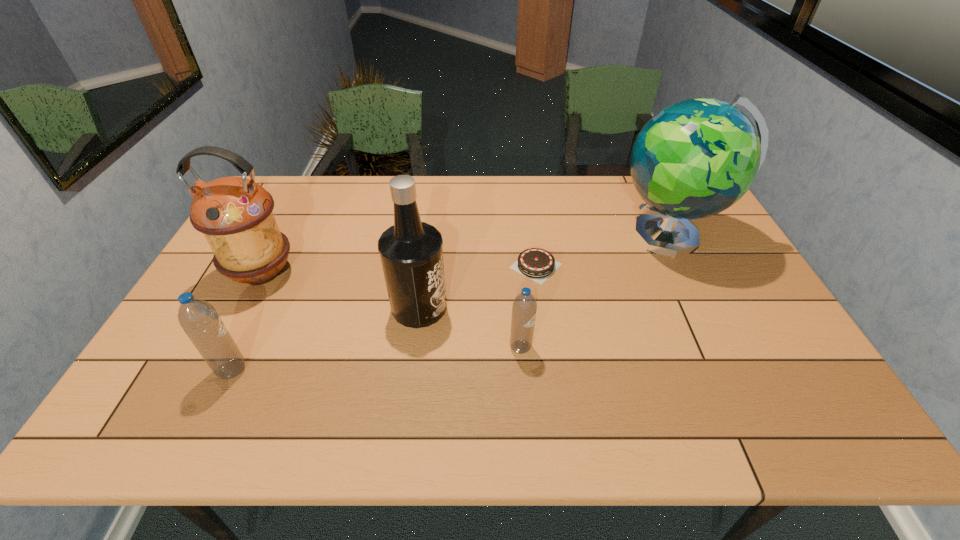
Where is `the fourth tallest object`? The height and width of the screenshot is (540, 960). the fourth tallest object is located at coordinates (198, 318).

The image size is (960, 540). Identify the location of the nearest object. (198, 318).

In order to click on the second nearest object in this screenshot , I will do 524,307.

In order to click on the shorter water bottle in this screenshot , I will do `click(524, 307)`.

This screenshot has width=960, height=540. I want to click on the rightmost object, so click(x=695, y=158).

Identify the location of liquor. Image resolution: width=960 pixels, height=540 pixels. (411, 253).

Where is `oil lamp`? Image resolution: width=960 pixels, height=540 pixels. oil lamp is located at coordinates (235, 214).

Identify the location of chocolate cake. This screenshot has width=960, height=540. (537, 264).

Locate an element on the screen. The width and height of the screenshot is (960, 540). vacant space positioned on the back of the nearer water bottle is located at coordinates (252, 329).

The width and height of the screenshot is (960, 540). I want to click on vacant space situated on the back of the fifth tallest object, so click(x=512, y=238).